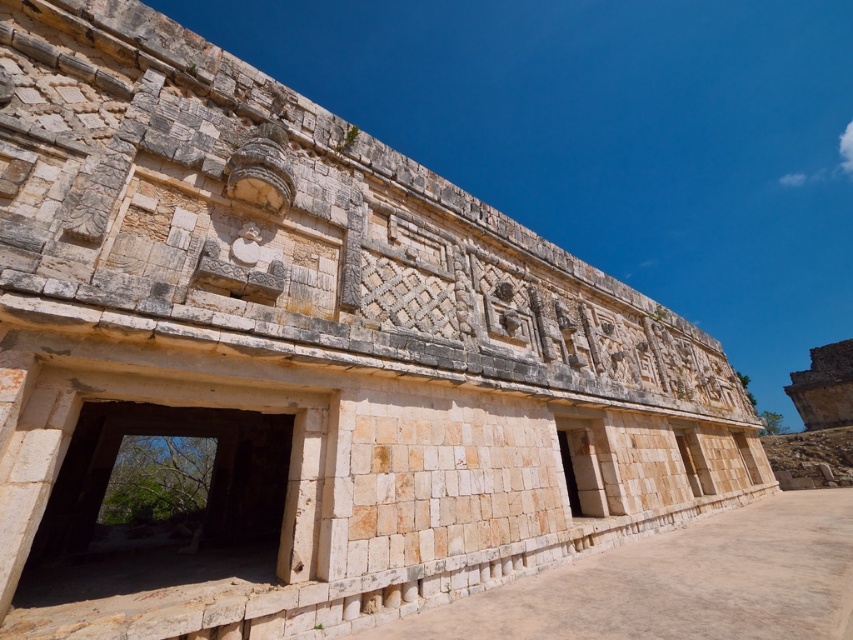
Question: Which point is farther to the camera?

Choices:
 (A) (599, 499)
 (B) (173, 529)

Answer: (B)

Question: Which point is closer to the camera?

Choices:
 (A) light beige stone door at center
 (B) light beige stone archway at center

Answer: (B)

Question: Does light beige stone archway at center have a smaller size compared to light beige stone door at center?

Choices:
 (A) no
 (B) yes

Answer: (A)

Question: Is light beige stone archway at center wider than light beige stone door at center?

Choices:
 (A) yes
 (B) no

Answer: (A)

Question: Does light beige stone archway at center appear on the right side of light beige stone door at center?

Choices:
 (A) no
 (B) yes

Answer: (A)